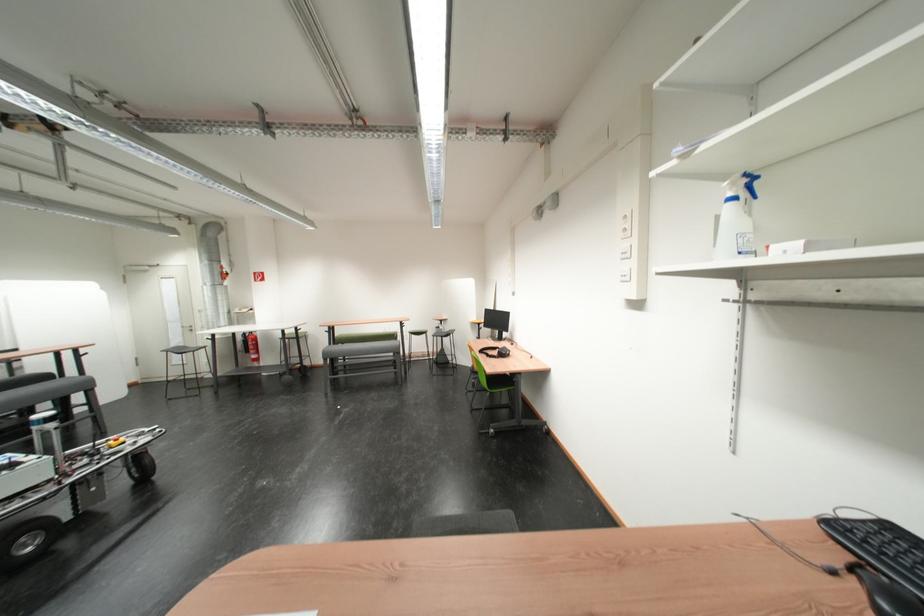
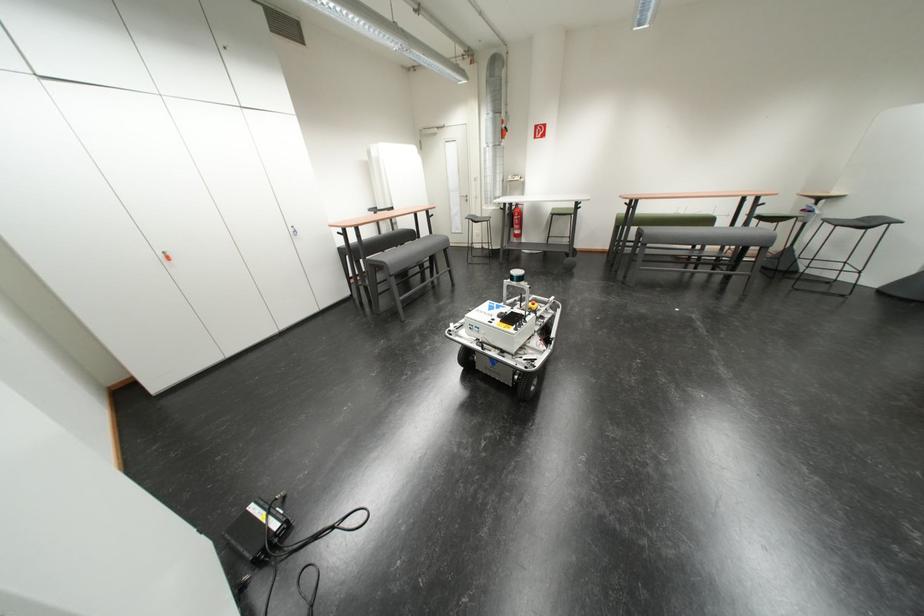
In the second image, find the point that corresponds to point (346, 342) in the first image.

(638, 223)